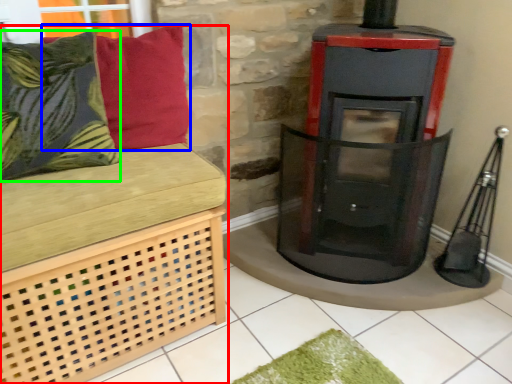
Question: Which object is the farthest from furniture (highlighted by a red box)? Choose among these: pillow (highlighted by a blue box) or pillow (highlighted by a green box).

Choices:
 (A) pillow
 (B) pillow

Answer: (A)